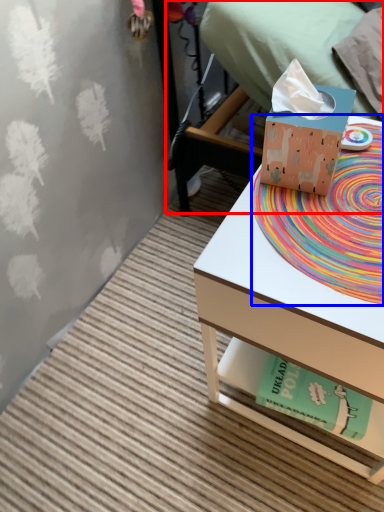
Question: Which of the following is the closest to the observer, bed (highlighted by a red box) or mat (highlighted by a blue box)?

Choices:
 (A) bed
 (B) mat

Answer: (B)